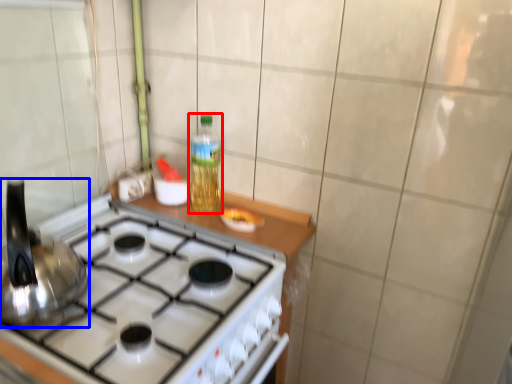
Question: Among these objects, which one is farthest to the camera, bottle (highlighted by a red box) or kitchen appliance (highlighted by a blue box)?

Choices:
 (A) bottle
 (B) kitchen appliance

Answer: (A)